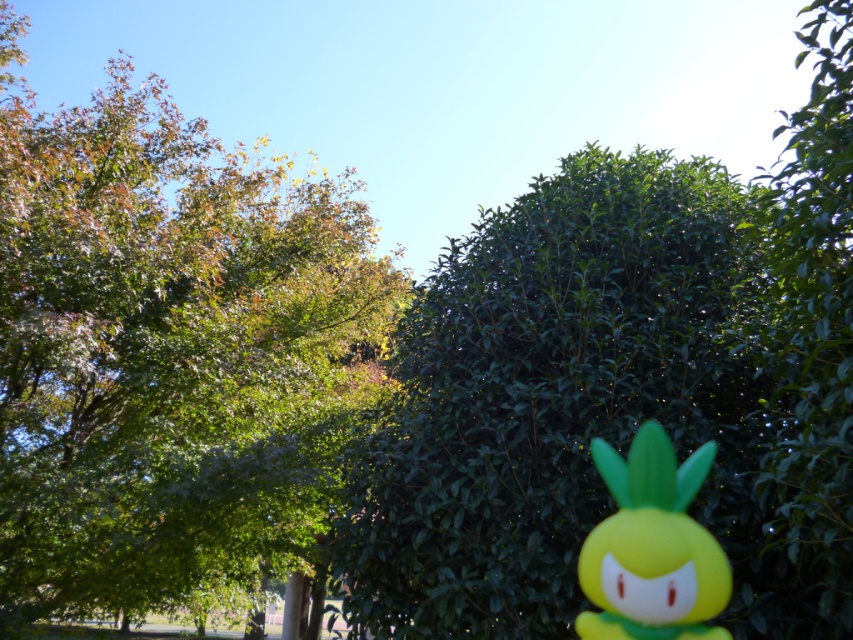
Does green leafy tree at right come behind yellow matte toy at right?

That is False.

Which is more to the left, green leafy tree at right or yellow matte toy at right?

From the viewer's perspective, yellow matte toy at right appears more on the left side.

Is point (815, 285) behind point (660, 512)?

No.

You are a GUI agent. You are given a task and a screenshot of the screen. Output one action in this format:
    pyautogui.click(x=<x>, y=<y>)
    Task: Click on the green leafy tree at right
    
    Given the screenshot: What is the action you would take?
    pyautogui.click(x=808, y=346)

Who is more distant from viewer, (x=360, y=237) or (x=677, y=467)?

The point (x=360, y=237) is behind.

Can you confirm if green leafy tree at upper left is thinner than yellow matte toy at right?

Yes, green leafy tree at upper left is thinner than yellow matte toy at right.

Image resolution: width=853 pixels, height=640 pixels. Find the location of `green leafy tree at upper left`. green leafy tree at upper left is located at coordinates (167, 353).

Describe the element at coordinates (167, 353) in the screenshot. I see `green leafy tree at upper left` at that location.

Can you confirm if green leafy tree at upper left is taller than green leafy hedge at center?

Incorrect, green leafy tree at upper left's height is not larger of green leafy hedge at center's.

Between point (210, 296) and point (422, 340), which one is positioned in front?

Point (422, 340)

Locate an element on the screen. The image size is (853, 640). green leafy tree at upper left is located at coordinates (167, 353).